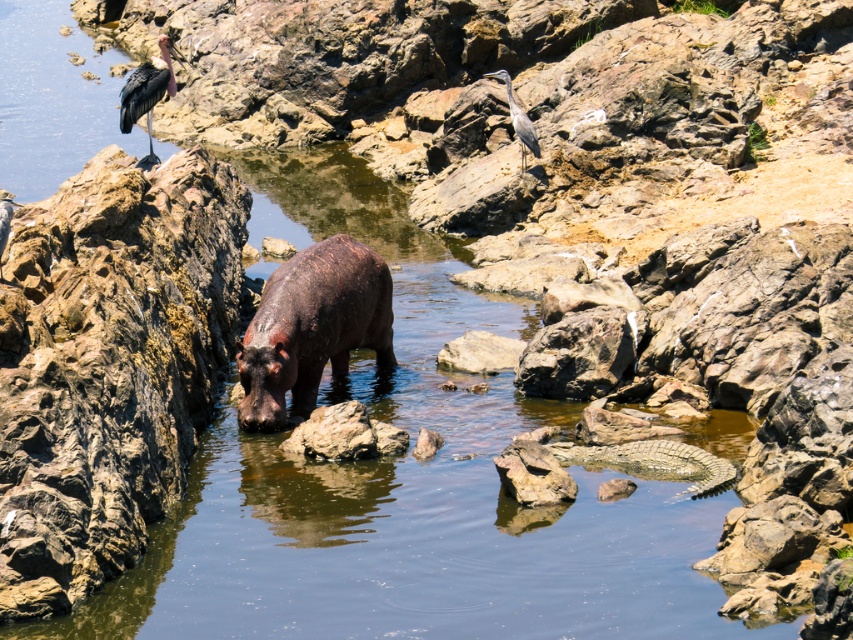
Question: Which of the following is the farthest from the observer?

Choices:
 (A) (525, 120)
 (B) (720, 484)
 (C) (138, 109)
 (D) (3, 228)

Answer: (A)

Question: Can you confirm if greenish-brown scaly crocodile at center is positioned below gray matte heron at upper center?

Choices:
 (A) no
 (B) yes

Answer: (B)

Question: Which of the following is the closest to the observer?

Choices:
 (A) (254, 422)
 (B) (486, 333)
 (C) (606, 460)
 (D) (7, 212)

Answer: (D)

Question: Which point is farther to the camera?

Choices:
 (A) (4, 241)
 (B) (163, 92)
 (C) (517, 344)

Answer: (B)

Question: Is dark brown textured hippo at center in front of greenish-brown scaly crocodile at center?

Choices:
 (A) no
 (B) yes

Answer: (A)

Question: Does greenish-brown scaly crocodile at center appear under smooth gray rock at center?

Choices:
 (A) yes
 (B) no

Answer: (A)